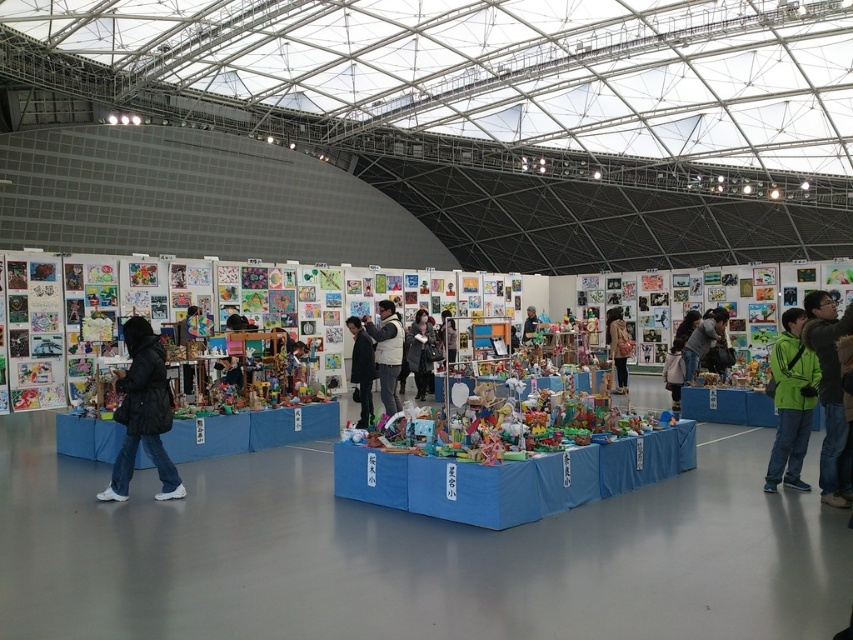
You are a visitor in the exhibition hall and want to pick up both the black matte jacket at lower left and the green jacket at lower right. Which jacket should you approach first to reach the one closer to you?

You should approach the black matte jacket at lower left first because it is closer to you than the green jacket at lower right.

You are an attendee at the exhibition and want to know which jacket is shorter between the green matte jacket at right and the black fuzzy jacket at center. Can you tell me?

The green matte jacket at right has a lesser height compared to the black fuzzy jacket at center, so the green matte jacket at right is shorter.